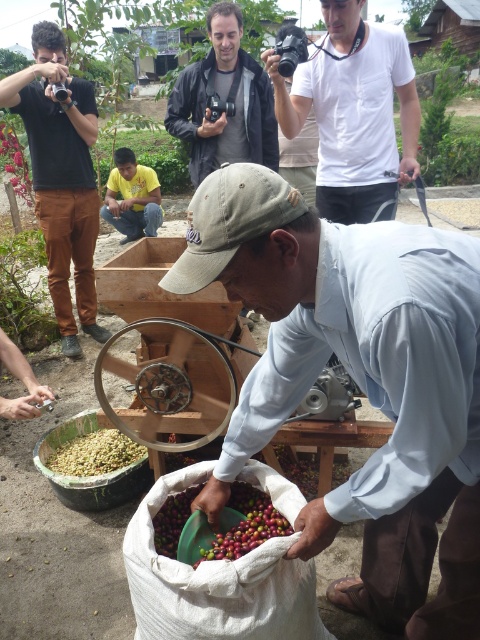
You are standing in the outdoor coffee processing scene. There is a point at coordinates (358,381). What object is located at this point?

The point at coordinates (358,381) is located on the light brown cotton shirt at center.

You are standing at the point marked as point (60,176) and want to take a photo of the man sorting coffee cherries. Is there an unobstructed view to the man from this position?

Yes, there is an unobstructed view to the man sorting coffee cherries from point (60,176) because the matte black camera at upper left is located at that point and there are no mentioned obstructions between it and the man.